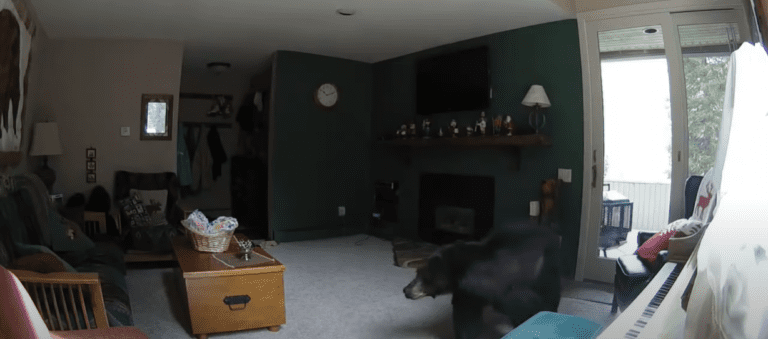
Identify the location of beige colored wall. This screenshot has height=339, width=768. (108, 78).